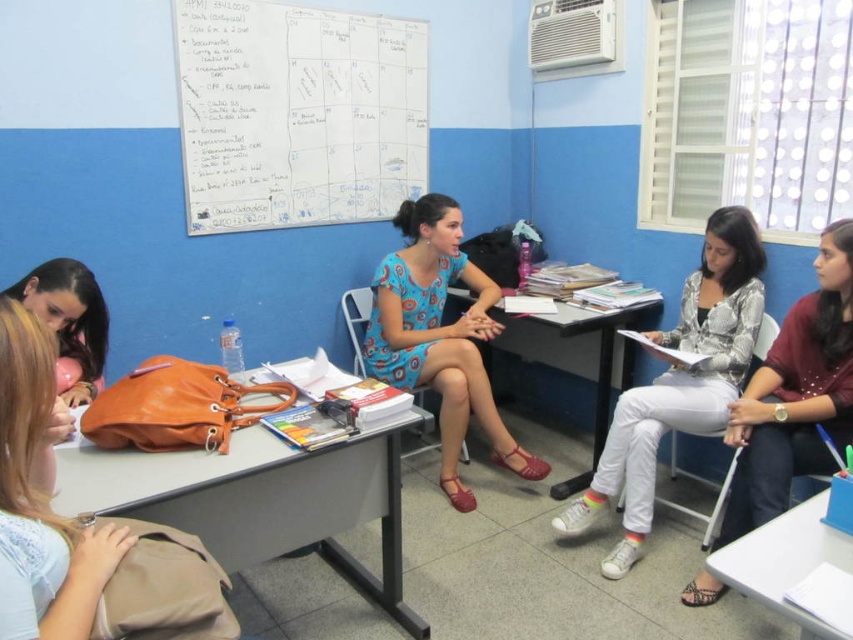
Who is taller, white matte pants at center or matte floral dress at center?

Standing taller between the two is white matte pants at center.

What do you see at coordinates (679, 381) in the screenshot? I see `white matte pants at center` at bounding box center [679, 381].

This screenshot has height=640, width=853. In order to click on white matte pants at center in this screenshot , I will do `click(679, 381)`.

Based on the photo, can you confirm if wooden table at center is taller than blue plastic table at lower right?

Yes, wooden table at center is taller than blue plastic table at lower right.

Does wooden table at center appear on the left side of blue plastic table at lower right?

Correct, you'll find wooden table at center to the left of blue plastic table at lower right.

Is point (624, 387) behind point (758, 547)?

Yes, it is behind point (758, 547).

Find the location of a particular element. wooden table at center is located at coordinates (573, 358).

Is matte beige backpack at lower left above matte black hair at lower left?

Incorrect, matte beige backpack at lower left is not positioned above matte black hair at lower left.

Which is behind, point (0, 452) or point (100, 378)?

Point (100, 378)

Between point (33, 483) and point (105, 314), which one is positioned behind?

Point (105, 314)

In order to click on matte beige backpack at lower left in this screenshot , I will do `click(41, 499)`.